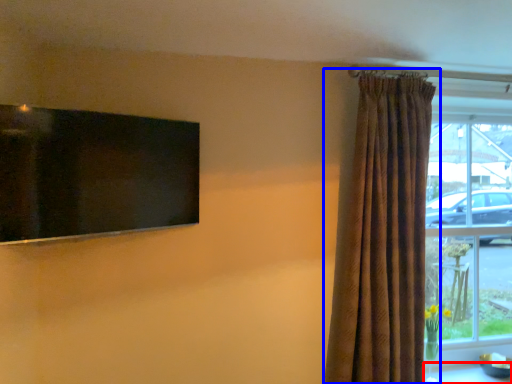
Question: Which object appears closest to the camera in this image, table (highlighted by a red box) or curtain (highlighted by a blue box)?

Choices:
 (A) table
 (B) curtain

Answer: (B)